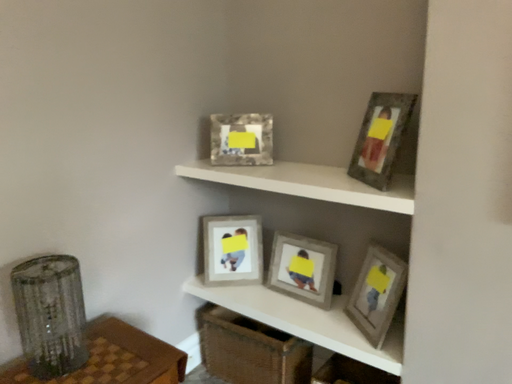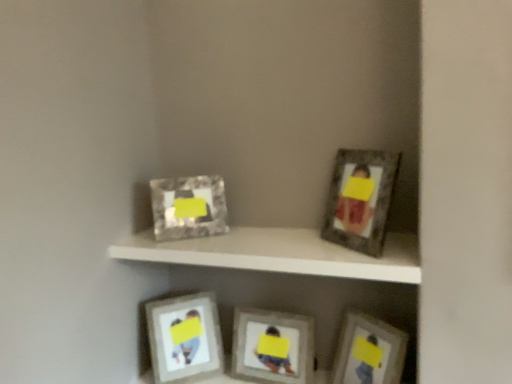
Question: How did the camera likely rotate when shooting the video?

Choices:
 (A) rotated left
 (B) rotated right

Answer: (B)